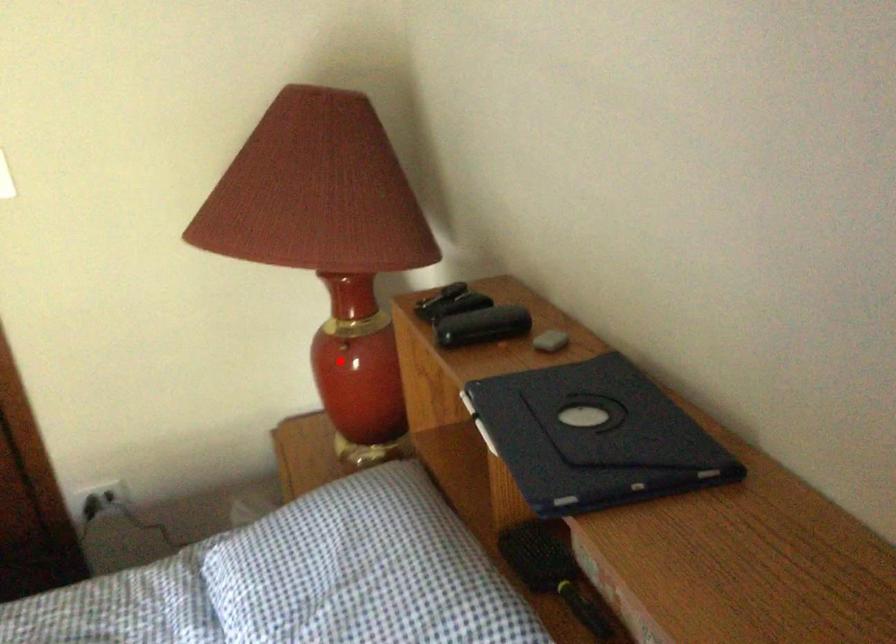
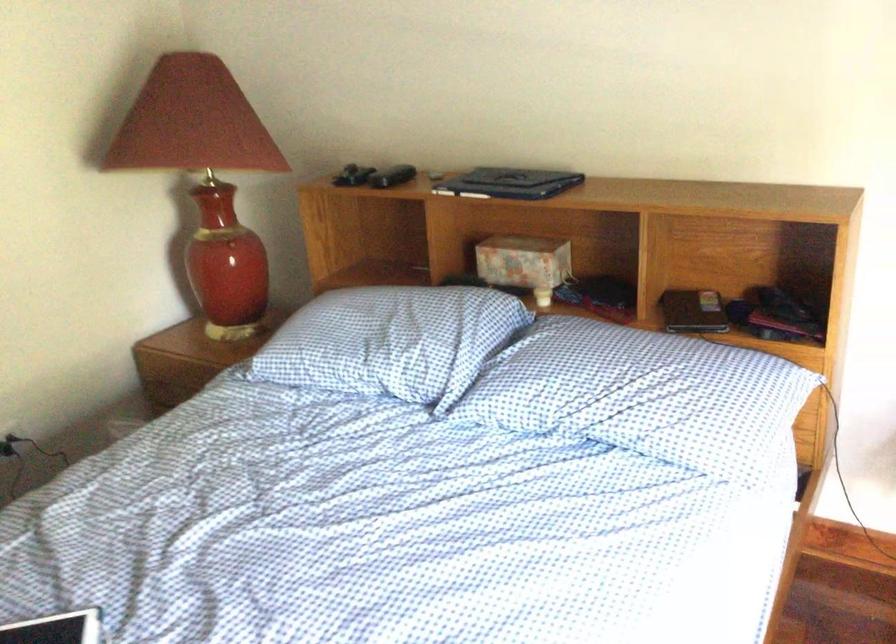
Question: I am providing you with two images of the same scene from different viewpoints. A red point is marked on the first image. Is the red point's position out of view in image 2?

Choices:
 (A) Yes
 (B) No

Answer: (B)